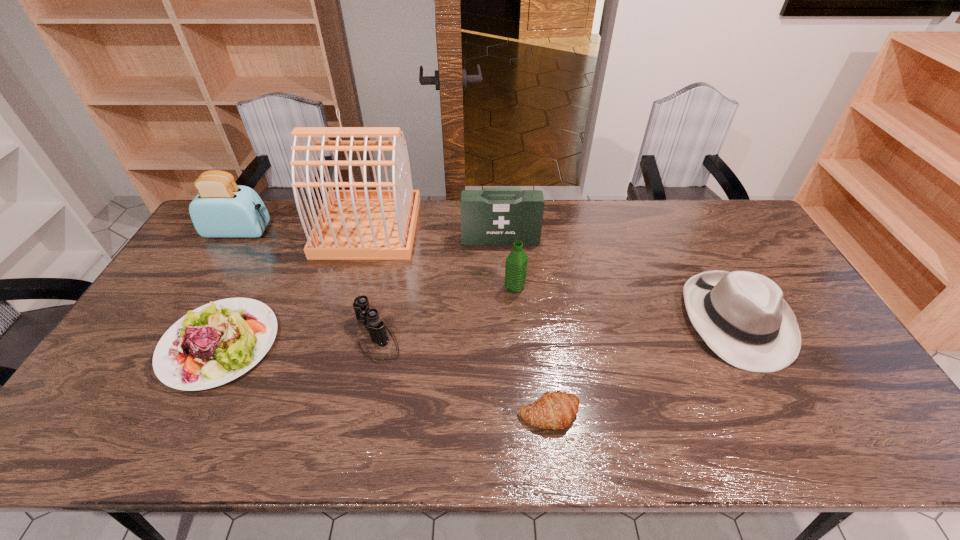
Find the location of a particular element. The height and width of the screenshot is (540, 960). free space at the far right corner of the desktop is located at coordinates (734, 219).

The height and width of the screenshot is (540, 960). Find the location of `empty location between the salad plate and the fourth shortest object`. empty location between the salad plate and the fourth shortest object is located at coordinates (478, 332).

The width and height of the screenshot is (960, 540). In order to click on free spot between the toaster and the nearest object in this screenshot , I will do `click(394, 323)`.

Locate an element on the screen. The image size is (960, 540). vacant area that lies between the toaster and the salad plate is located at coordinates (229, 288).

Locate an element on the screen. The image size is (960, 540). free space between the crescent roll and the first-aid kit is located at coordinates (524, 327).

Locate an element on the screen. The width and height of the screenshot is (960, 540). free space that is in between the water bottle and the nearest object is located at coordinates (532, 351).

This screenshot has height=540, width=960. Identify the location of vacant area that lies between the tallest object and the first-aid kit. (434, 233).

Locate an element on the screen. vacant area that lies between the binoculars and the birdcage is located at coordinates (372, 281).

Locate which object ranks second in proximity to the toaster. Please provide its 2D coordinates. Your answer should be formatted as a tuple, i.e. [(x, y)], where the tuple contains the x and y coordinates of a point satisfying the conditions above.

[(216, 343)]

Locate which object ranks seventh in proximity to the tallest object. Please provide its 2D coordinates. Your answer should be formatted as a tuple, i.e. [(x, y)], where the tuple contains the x and y coordinates of a point satisfying the conditions above.

[(742, 316)]